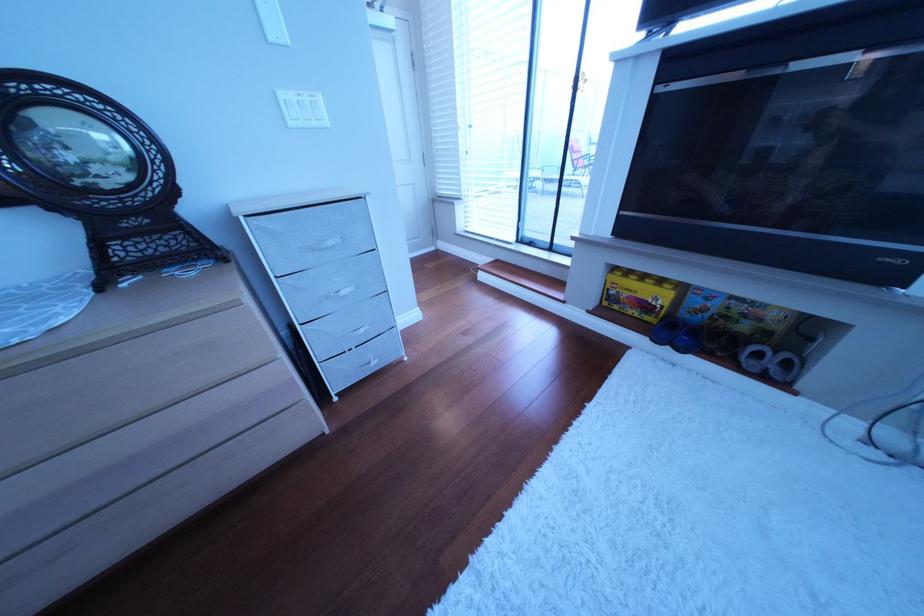
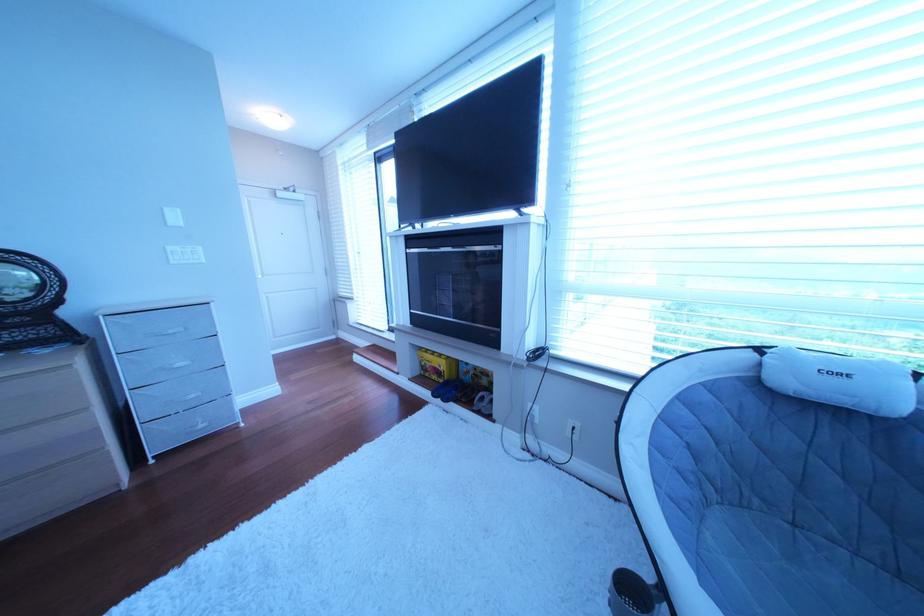
In the second image, find the point that corresponds to point 346,246 in the first image.

(188, 334)